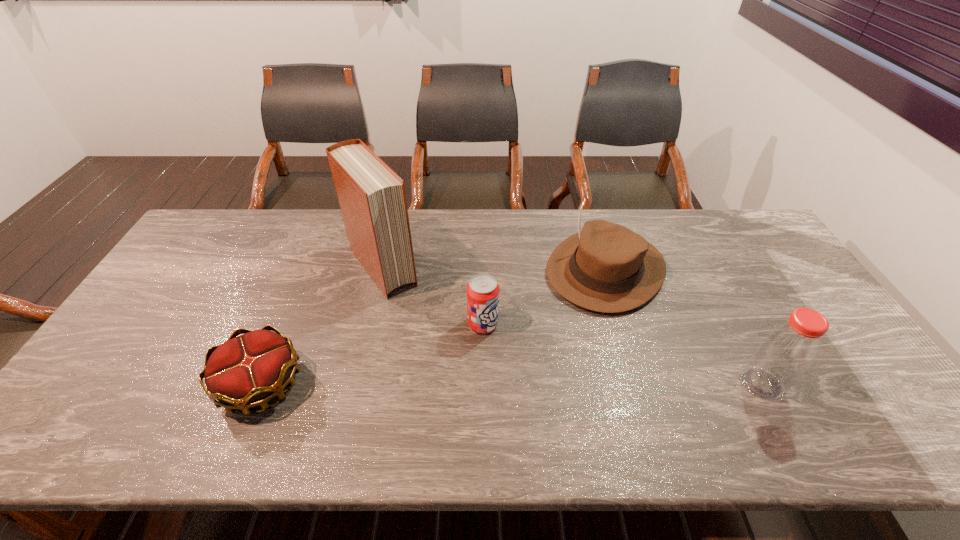
Identify the location of vacant space on the desktop that is between the shortest object and the bottle and is positioned on the open cover of the tallest object. (474, 384).

Identify the location of free space on the desktop that is between the crown and the rightmost object and is positioned on the surface of the soda can. (554, 384).

Find the location of `vacant spot on the desktop that is between the leftmost object and the fourth shortest object and is positioned on the feather side of the second object from right to left`. vacant spot on the desktop that is between the leftmost object and the fourth shortest object and is positioned on the feather side of the second object from right to left is located at coordinates (497, 384).